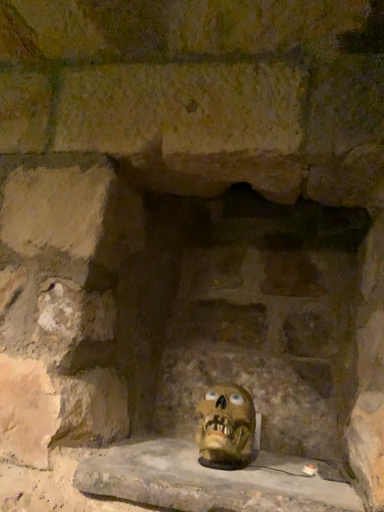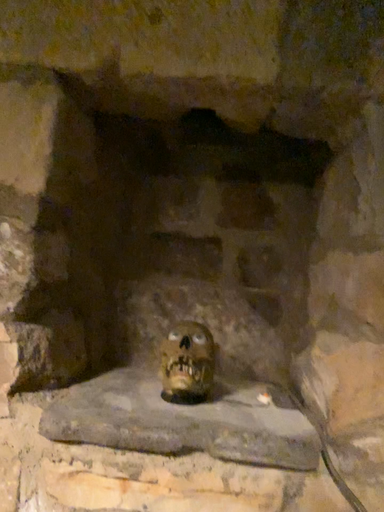
Question: Which way did the camera rotate in the video?

Choices:
 (A) rotated left
 (B) rotated right

Answer: (B)